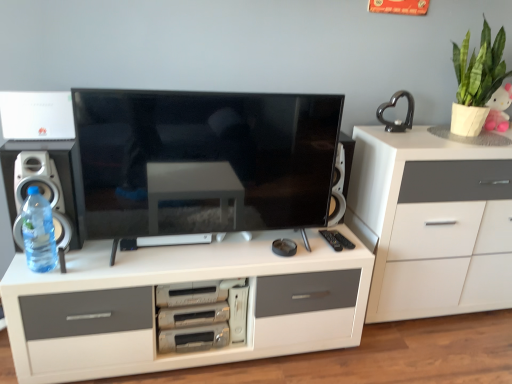
This screenshot has height=384, width=512. I want to click on vacant area on top of white plastic speaker at left (from a real-world perspective), so click(x=40, y=133).